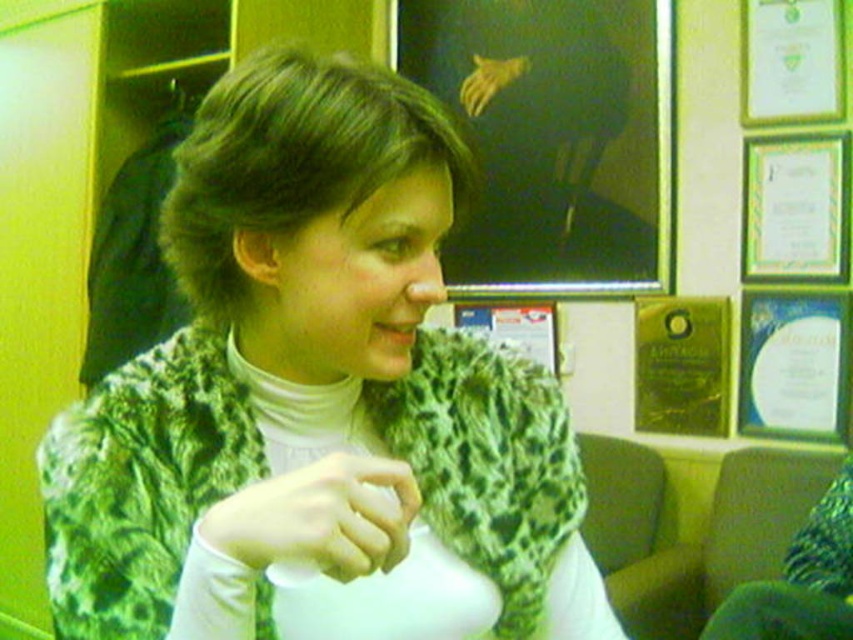
Question: Which of the following is the closest to the observer?

Choices:
 (A) (605, 259)
 (B) (341, 548)
 (C) (189, 502)

Answer: (B)

Question: Can you confirm if matte black board at upper center is positioned to the left of green matte hand at center?

Choices:
 (A) no
 (B) yes

Answer: (A)

Question: Can you confirm if green textured scarf at center is thinner than matte black board at upper center?

Choices:
 (A) yes
 (B) no

Answer: (A)

Question: Which point appears closest to the camera in this image?

Choices:
 (A) tap(361, 490)
 (B) tap(497, 230)

Answer: (A)

Question: Does green textured scarf at center have a smaller size compared to green matte hand at center?

Choices:
 (A) yes
 (B) no

Answer: (B)

Question: Which of the following is the closest to the observer?

Choices:
 (A) (329, 538)
 (B) (514, 163)

Answer: (A)